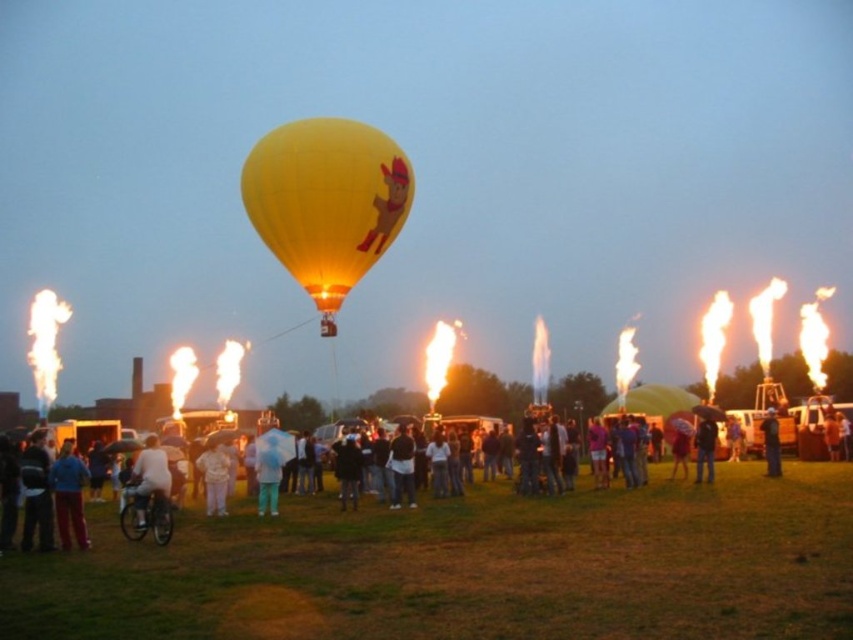
Based on the photo, who is shorter, yellow matte hot air balloon at center or light blue fabric umbrella at center?

light blue fabric umbrella at center

Who is more distant from viewer, (268,138) or (706,451)?

Point (706,451)

This screenshot has height=640, width=853. I want to click on yellow matte hot air balloon at center, so click(326, 200).

Is blue fabric jacket at lower left to the left of blue fabric umbrella at center from the viewer's perspective?

Correct, you'll find blue fabric jacket at lower left to the left of blue fabric umbrella at center.

Can you confirm if blue fabric jacket at lower left is positioned above blue fabric umbrella at center?

No.

Which is in front, point (68, 508) or point (772, 435)?

Positioned in front is point (68, 508).

Where is `blue fabric jacket at lower left`? This screenshot has height=640, width=853. blue fabric jacket at lower left is located at coordinates (68, 496).

Does white cotton shirt at center lie behind blue fabric jacket at lower left?

No.

Looking at this image, does white cotton shirt at center appear on the right side of blue fabric jacket at lower left?

Yes, white cotton shirt at center is to the right of blue fabric jacket at lower left.

Which is in front, point (459, 508) or point (79, 497)?

Point (79, 497) is in front.

You are a GUI agent. You are given a task and a screenshot of the screen. Output one action in this format:
    pyautogui.click(x=<x>, y=<y>)
    Task: Click on the white cotton shirt at center
    This screenshot has height=640, width=853.
    Given the screenshot: What is the action you would take?
    pyautogui.click(x=569, y=512)